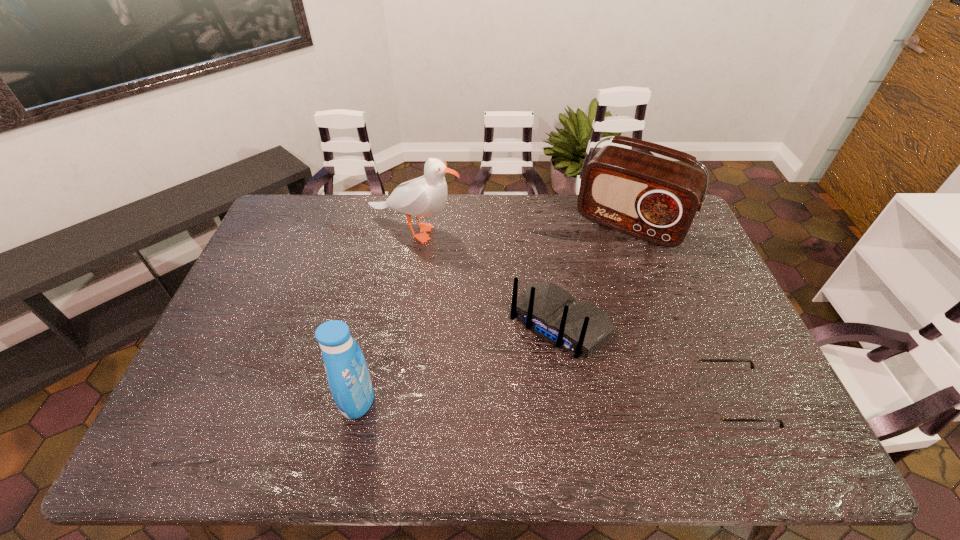
Identify the location of unoccupied position between the radio receiver and the gull. The height and width of the screenshot is (540, 960). (522, 227).

The image size is (960, 540). What are the coordinates of `free spot between the third nearest object and the shortest object` in the screenshot? It's located at (646, 362).

Find the location of a particular element. This screenshot has width=960, height=540. free area in between the router and the shortest object is located at coordinates (646, 362).

Locate an element on the screen. object identified as the second closest to the detergent is located at coordinates (424, 196).

Locate an element on the screen. the second closest object relative to the radio receiver is located at coordinates point(424,196).

I want to click on blank area in the image that satisfies the following two spatial constraints: 1. on the front side of the radio receiver; 2. at the hinge ends of the spectacles, so click(x=695, y=399).

I want to click on vacant region that satisfies the following two spatial constraints: 1. on the back side of the third farthest object; 2. on the left side of the radio receiver, so click(x=544, y=224).